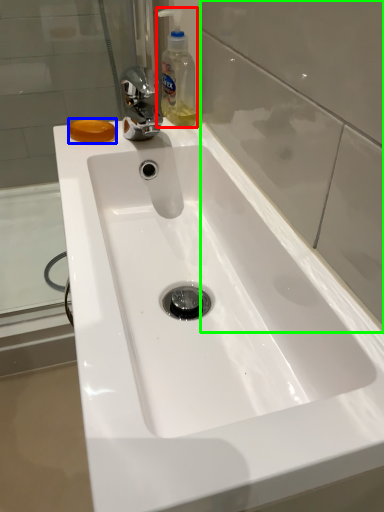
Question: Based on their relative distances, which object is nearer to cleaning product (highlighted by a red box)? Choose from soap (highlighted by a blue box) and glass door (highlighted by a green box).

Choices:
 (A) soap
 (B) glass door

Answer: (A)